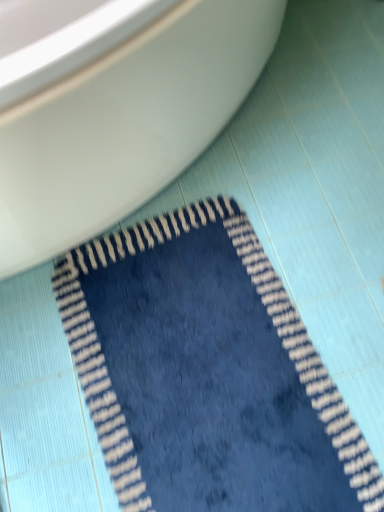
The height and width of the screenshot is (512, 384). Find the location of `free spot below navy blue plush rug at lower center (from a real-world perspective)`. free spot below navy blue plush rug at lower center (from a real-world perspective) is located at coordinates 194,389.